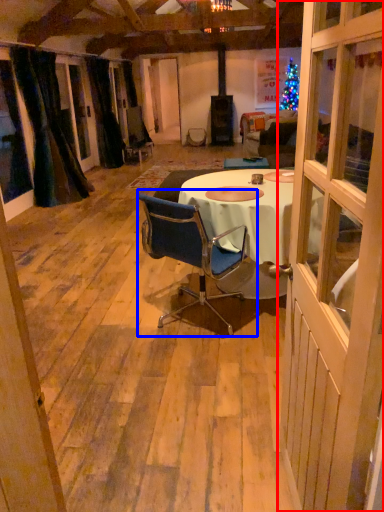
Question: Which point is further to the camera, door (highlighted by a red box) or chair (highlighted by a blue box)?

Choices:
 (A) door
 (B) chair

Answer: (B)